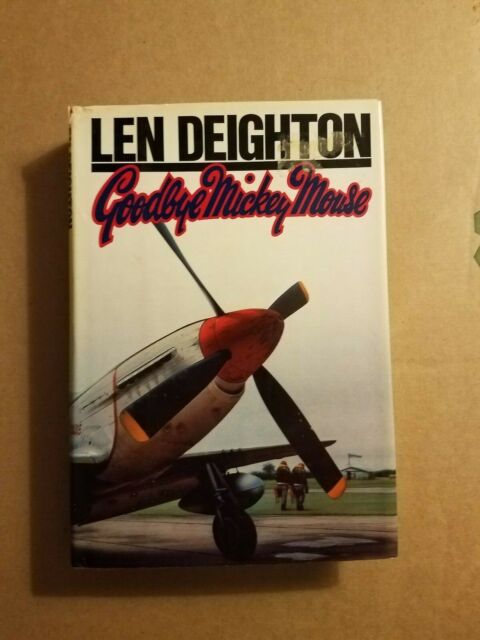
The image size is (480, 640). Find the location of `book`. book is located at coordinates (366, 315).